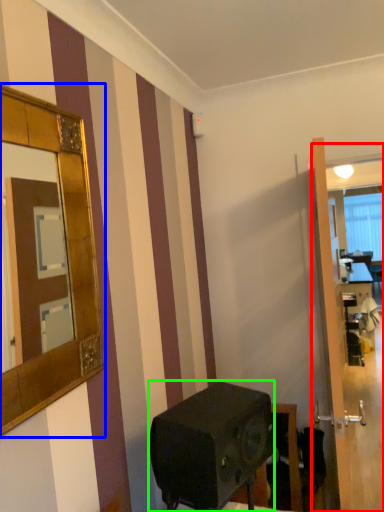
Question: Which object is positioned closest to glass door (highlighted by a red box)? Select from mirror (highlighted by a blue box) and appliance (highlighted by a green box).

Choices:
 (A) mirror
 (B) appliance

Answer: (B)